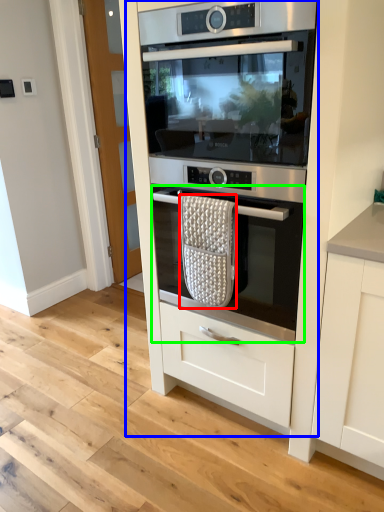
Question: Which object is the closest to the material (highlighted by a red box)? Choose among these: oven (highlighted by a blue box) or oven (highlighted by a green box).

Choices:
 (A) oven
 (B) oven

Answer: (B)